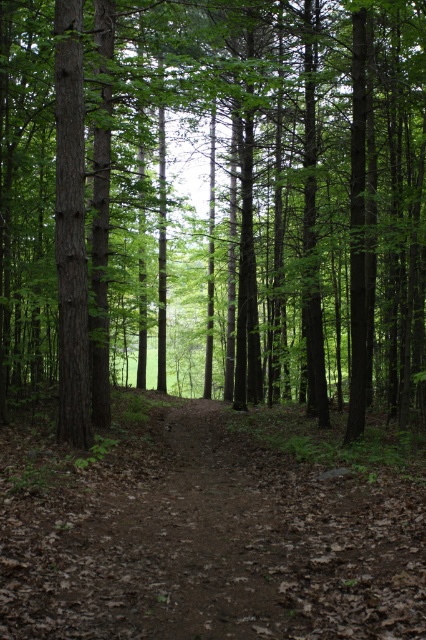
Question: Is brown wood tree at center below brown dirt trail at center?

Choices:
 (A) no
 (B) yes

Answer: (A)

Question: Which of the following is the closest to the observer?

Choices:
 (A) (22, 208)
 (B) (77, 538)

Answer: (B)

Question: Is brown wood tree at center above brown dirt trail at center?

Choices:
 (A) no
 (B) yes

Answer: (B)

Question: Does brown wood tree at center appear under brown dirt trail at center?

Choices:
 (A) no
 (B) yes

Answer: (A)

Question: Which point is farther to the camera?

Choices:
 (A) brown dirt trail at center
 (B) brown wood tree at center

Answer: (B)